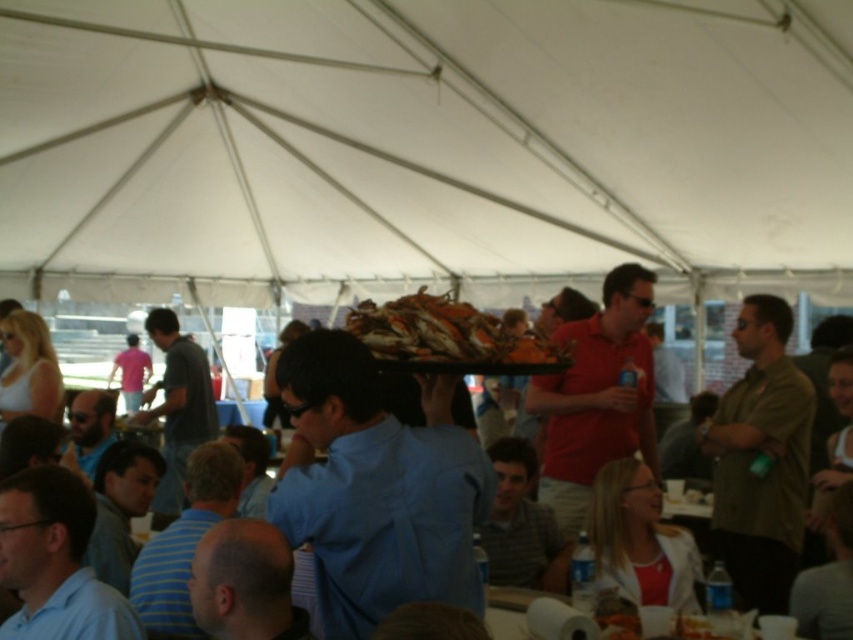
Is green matte shirt at center behind orange shellfish at center?

That is True.

Find the location of a particular element. green matte shirt at center is located at coordinates (757, 454).

Does point (766, 401) lie behind point (476, 314)?

That is True.

Locate an element on the screen. green matte shirt at center is located at coordinates (757, 454).